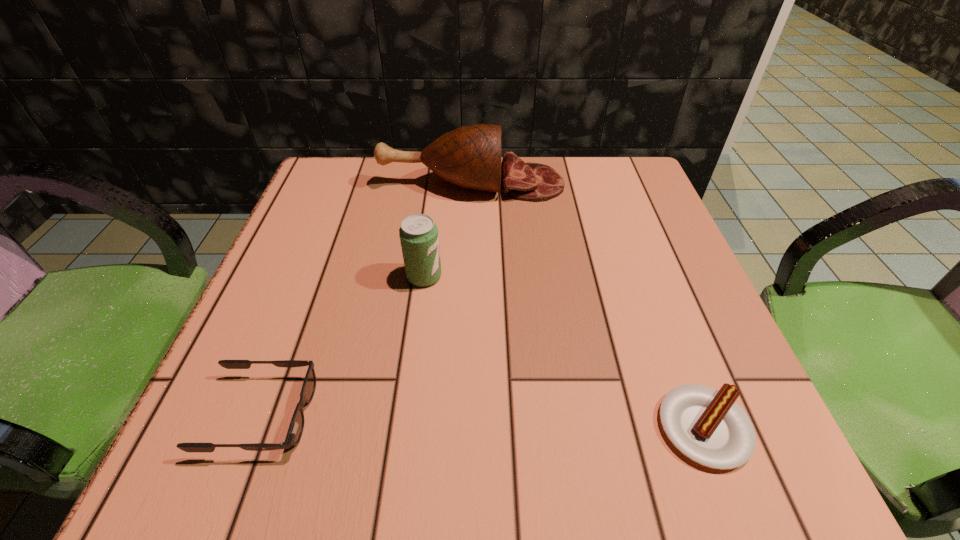
The width and height of the screenshot is (960, 540). I want to click on vacant region that satisfies the following two spatial constraints: 1. on the temples of the shortest object; 2. on the left side of the sunglasses, so click(256, 428).